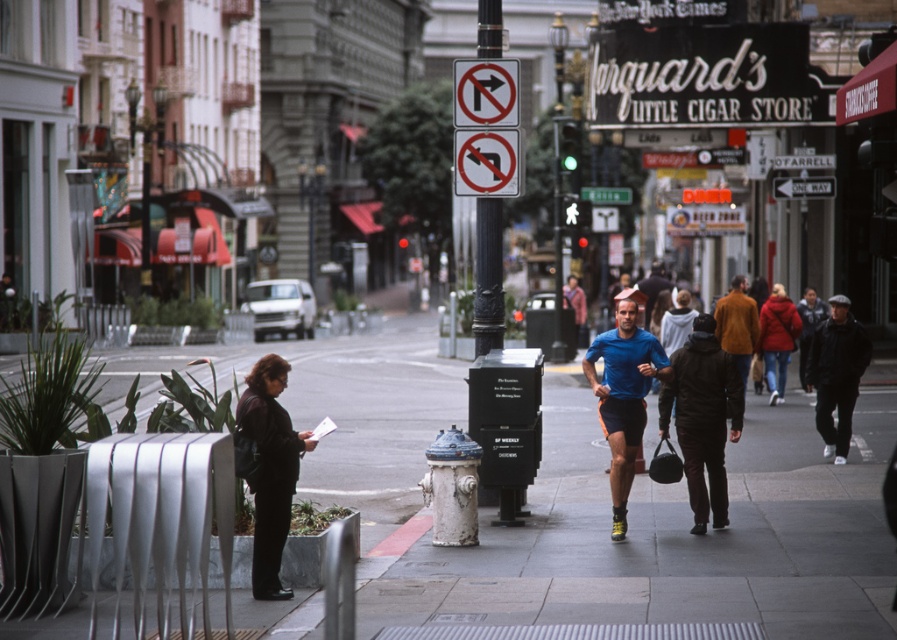
Question: Does smooth concrete sidewalk at center appear over black leather jacket at lower left?

Choices:
 (A) yes
 (B) no

Answer: (B)

Question: Can you confirm if smooth concrete sidewalk at center is wider than black leather jacket at lower left?

Choices:
 (A) no
 (B) yes

Answer: (B)

Question: Does smooth concrete sidewalk at center appear over black leather jacket at lower left?

Choices:
 (A) no
 (B) yes

Answer: (A)

Question: Which point is closer to the camera?

Choices:
 (A) smooth concrete sidewalk at center
 (B) black leather jacket at lower left

Answer: (A)